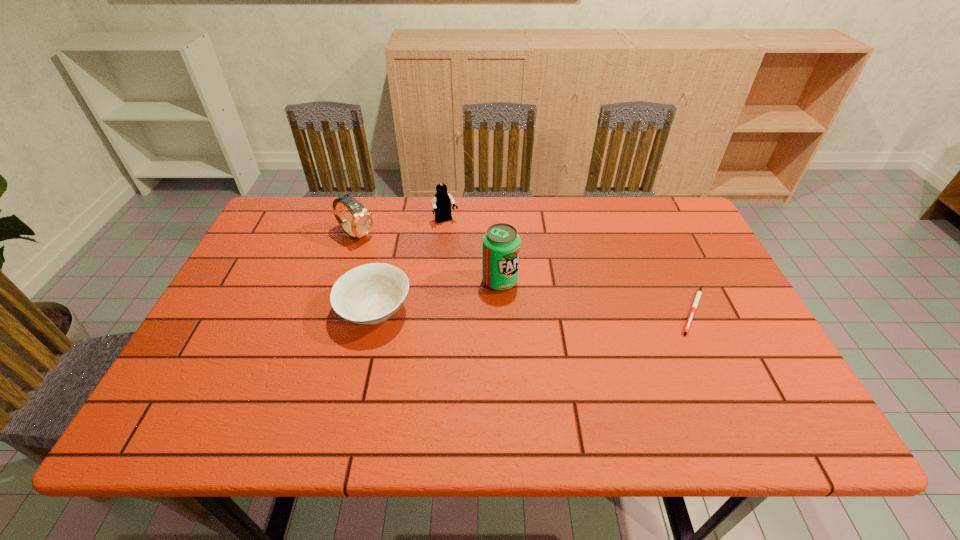
At what (x,y) coordinates should I click in order to perform the action: click on free spot between the tallest object and the third object from right to left. Please return your answer as a coordinate pair (x, y). This screenshot has height=540, width=960. Looking at the image, I should click on (473, 251).

Find the location of `free space between the watch and the rightmost object`. free space between the watch and the rightmost object is located at coordinates (524, 273).

Where is `free area in between the Lego and the pen`? free area in between the Lego and the pen is located at coordinates (569, 266).

Where is `empty location between the third object from left to right and the pop soda`? This screenshot has height=540, width=960. empty location between the third object from left to right and the pop soda is located at coordinates (473, 251).

At what (x,y) coordinates should I click in order to perform the action: click on vacant point located between the shortest object and the watch. Please return your answer as a coordinate pair (x, y). Image resolution: width=960 pixels, height=540 pixels. Looking at the image, I should click on (524, 273).

At what (x,y) coordinates should I click in order to perform the action: click on free space between the rightmost object and the tallest object. Please return your answer as a coordinate pair (x, y). Looking at the image, I should click on (596, 296).

This screenshot has height=540, width=960. What are the coordinates of `the second closest object to the bowl` in the screenshot? It's located at (501, 243).

Locate which object ranks in proximity to the shortest object. Please provide its 2D coordinates. Your answer should be formatted as a tuple, i.e. [(x, y)], where the tuple contains the x and y coordinates of a point satisfying the conditions above.

[(501, 243)]